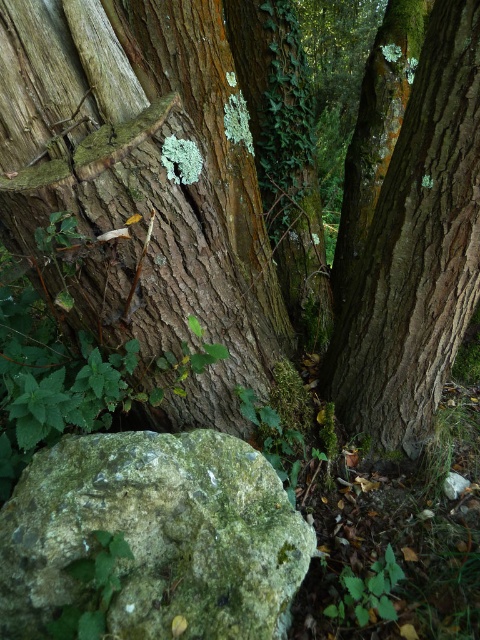
Question: Which point is farther to the camera?

Choices:
 (A) (440, 208)
 (B) (227, 237)

Answer: (B)

Question: Does green mossy rock at lower left have a greater width compared to smooth brown bark at center?

Choices:
 (A) yes
 (B) no

Answer: (A)

Question: Can you confirm if rough bark tree at center is wider than green mossy rock at lower left?

Choices:
 (A) no
 (B) yes

Answer: (B)

Question: Which of the following is the farthest from the observer?

Choices:
 (A) smooth brown bark at center
 (B) green mossy rock at lower left
 (C) rough bark tree at center

Answer: (A)

Question: Does rough bark tree at center have a greater width compared to smooth brown bark at center?

Choices:
 (A) no
 (B) yes

Answer: (B)

Question: Among these objects, which one is farthest from the camera?

Choices:
 (A) green mossy rock at lower left
 (B) rough bark tree at center

Answer: (B)